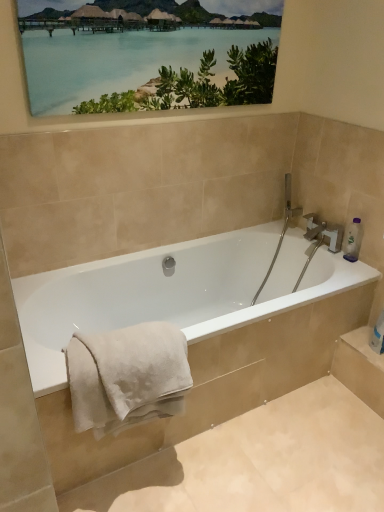
Question: Can you confirm if white glossy bathtub at center is bigger than white soft towel at lower left?

Choices:
 (A) yes
 (B) no

Answer: (A)

Question: Is white glossy bathtub at center wider than white soft towel at lower left?

Choices:
 (A) no
 (B) yes

Answer: (B)

Question: Is white glossy bathtub at center to the right of white soft towel at lower left from the viewer's perspective?

Choices:
 (A) yes
 (B) no

Answer: (A)

Question: Does white glossy bathtub at center have a smaller size compared to white soft towel at lower left?

Choices:
 (A) yes
 (B) no

Answer: (B)

Question: Is white glossy bathtub at center positioned behind white soft towel at lower left?

Choices:
 (A) no
 (B) yes

Answer: (B)

Question: In terms of height, does matte wooden picture frame at upper center look taller or shorter compared to white glossy bathtub at center?

Choices:
 (A) short
 (B) tall

Answer: (A)

Question: From the image's perspective, is matte wooden picture frame at upper center positioned above or below white glossy bathtub at center?

Choices:
 (A) below
 (B) above

Answer: (B)

Question: Choose the correct answer: Is matte wooden picture frame at upper center inside white glossy bathtub at center or outside it?

Choices:
 (A) inside
 (B) outside

Answer: (B)

Question: Is matte wooden picture frame at upper center wider or thinner than white glossy bathtub at center?

Choices:
 (A) wide
 (B) thin

Answer: (B)

Question: Considering the positions of white soft towel at lower left and white glossy bathtub at center in the image, is white soft towel at lower left bigger or smaller than white glossy bathtub at center?

Choices:
 (A) small
 (B) big

Answer: (A)

Question: From the image's perspective, is white soft towel at lower left above or below white glossy bathtub at center?

Choices:
 (A) below
 (B) above

Answer: (A)

Question: Visually, is white soft towel at lower left positioned to the left or to the right of white glossy bathtub at center?

Choices:
 (A) right
 (B) left

Answer: (B)

Question: Which is correct: white soft towel at lower left is inside white glossy bathtub at center, or outside of it?

Choices:
 (A) outside
 (B) inside

Answer: (B)

Question: Is matte wooden picture frame at upper center to the left or to the right of clear plastic bottle at upper right in the image?

Choices:
 (A) left
 (B) right

Answer: (A)

Question: Considering the positions of matte wooden picture frame at upper center and clear plastic bottle at upper right in the image, is matte wooden picture frame at upper center wider or thinner than clear plastic bottle at upper right?

Choices:
 (A) thin
 (B) wide

Answer: (B)